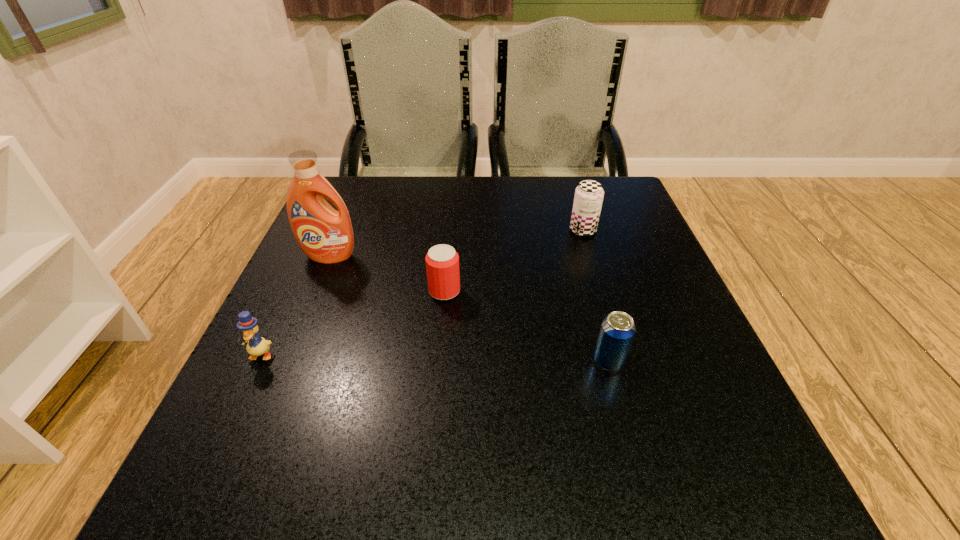
Image resolution: width=960 pixels, height=540 pixels. Identify the location of free space between the second tallest object and the detergent. (456, 244).

I want to click on free area in between the tallest beer can and the detergent, so click(456, 244).

Where is `free space between the leftmost beer can and the fourth nearest object`? Image resolution: width=960 pixels, height=540 pixels. free space between the leftmost beer can and the fourth nearest object is located at coordinates (387, 274).

Where is `free space between the tallest beer can and the duckling`? This screenshot has width=960, height=540. free space between the tallest beer can and the duckling is located at coordinates (421, 293).

Choose which object is the fourth nearest neighbor to the fourth nearest object. Please provide its 2D coordinates. Your answer should be formatted as a tuple, i.e. [(x, y)], where the tuple contains the x and y coordinates of a point satisfying the conditions above.

[(617, 331)]

Choose which object is the third nearest neighbor to the nearest beer can. Please provide its 2D coordinates. Your answer should be formatted as a tuple, i.e. [(x, y)], where the tuple contains the x and y coordinates of a point satisfying the conditions above.

[(325, 235)]

Where is `beer can that is the second closest to the second tallest object`? The image size is (960, 540). beer can that is the second closest to the second tallest object is located at coordinates (617, 331).

The height and width of the screenshot is (540, 960). I want to click on the second closest beer can to the fourth nearest object, so click(x=589, y=194).

The height and width of the screenshot is (540, 960). In order to click on free spot that satisfies the following two spatial constraints: 1. on the front-facing side of the nearest beer can; 2. on the left side of the detergent in this screenshot , I will do `click(286, 361)`.

Find the location of a particular element. free spot that satisfies the following two spatial constraints: 1. on the front-facing side of the tallest object; 2. on the right side of the nearest beer can is located at coordinates (286, 361).